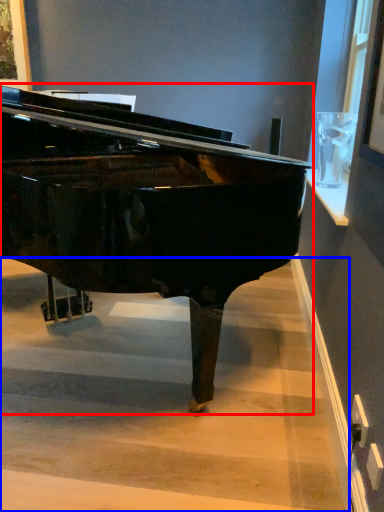
Question: Which of the following is the farthest to the observer, piano (highlighted by a red box) or stairwell (highlighted by a blue box)?

Choices:
 (A) piano
 (B) stairwell

Answer: (B)